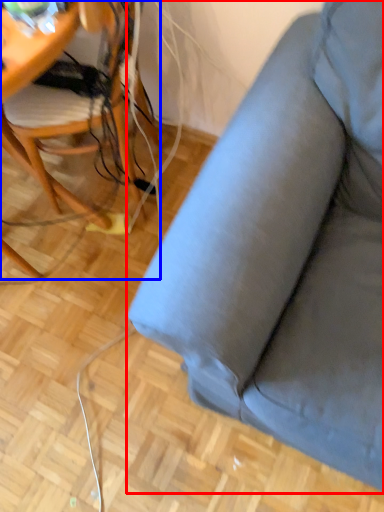
Question: Which of the following is the farthest to the observer, studio couch (highlighted by a red box) or chair (highlighted by a blue box)?

Choices:
 (A) studio couch
 (B) chair

Answer: (B)